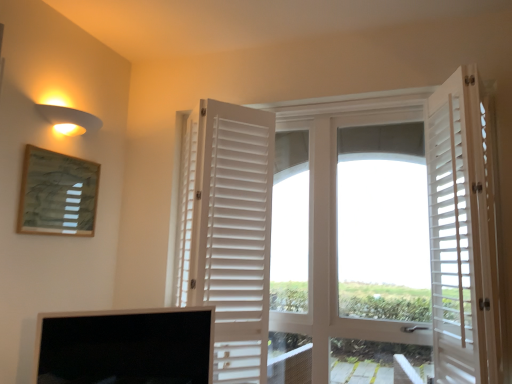
Question: Which is correct: wooden textured picture frame at upper left is inside black glossy screen at lower left, or outside of it?

Choices:
 (A) inside
 (B) outside

Answer: (B)

Question: Is wooden textured picture frame at upper left taller or shorter than black glossy screen at lower left?

Choices:
 (A) tall
 (B) short

Answer: (A)

Question: Which object is positioned closest to the white wooden shutters at right, acting as the 3th door starting from the left?

Choices:
 (A) black glossy screen at lower left
 (B) matte yellow wall sconce at upper left
 (C) wooden textured picture frame at upper left
 (D) white wooden door at center, arranged as the 2th door when viewed from the right
 (E) white matte shutters at center, which is counted as the 1th door, starting from the left

Answer: (D)

Question: Which is farther from the matte yellow wall sconce at upper left?

Choices:
 (A) white wooden door at center, marked as the 2th door in a left-to-right arrangement
 (B) wooden textured picture frame at upper left
 (C) white matte shutters at center, the 3th door positioned from the right
 (D) white wooden shutters at right, positioned as the first door in right-to-left order
 (E) black glossy screen at lower left

Answer: (D)